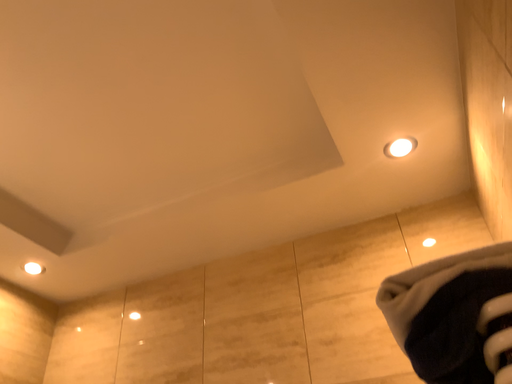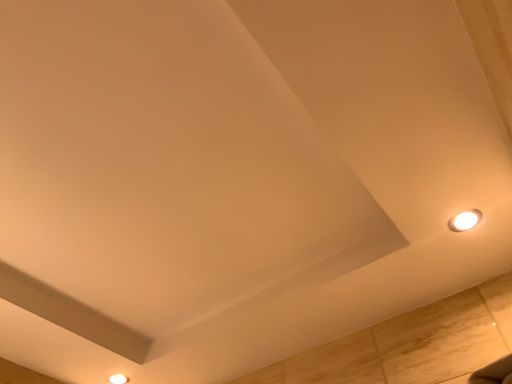
Question: Which way did the camera rotate in the video?

Choices:
 (A) rotated right
 (B) rotated left

Answer: (B)